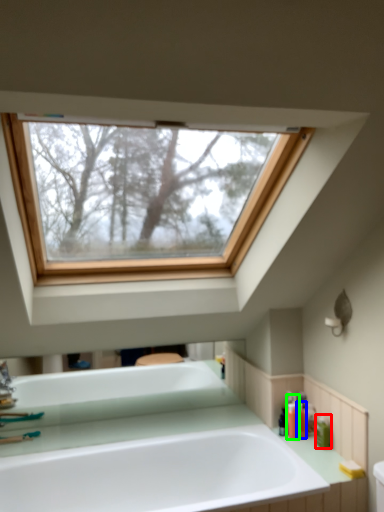
Question: Considering the real-world distances, which object is closest to toiletry (highlighted by a red box)? toiletry (highlighted by a blue box) or toiletry (highlighted by a green box).

Choices:
 (A) toiletry
 (B) toiletry

Answer: (A)